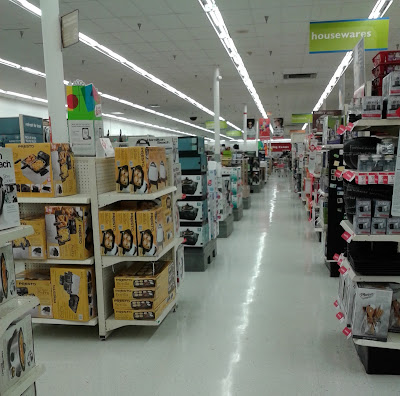
The image size is (400, 396). I want to click on crockpots in boxes, so click(x=13, y=355), click(x=4, y=280).